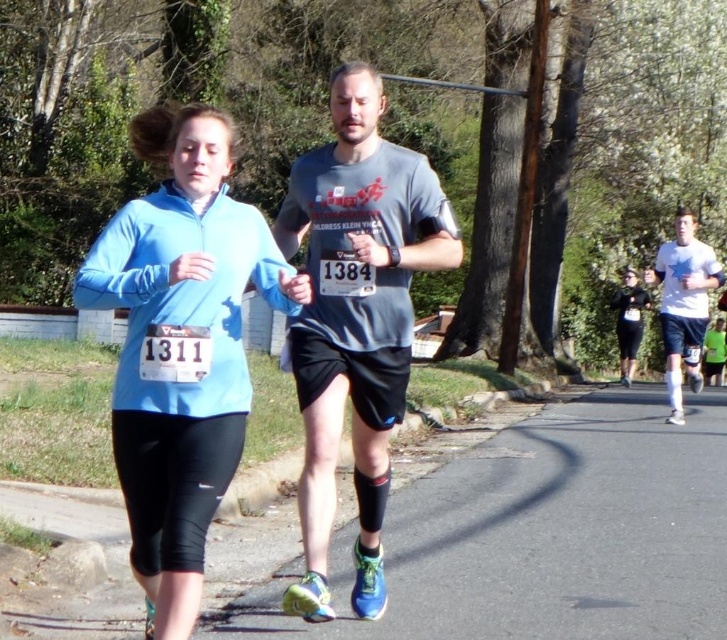
Question: Does gray matte t-shirt at center appear on the right side of black matte leggings at center?

Choices:
 (A) no
 (B) yes

Answer: (A)

Question: Is white matte t-shirt at center wider than black matte leggings at center?

Choices:
 (A) yes
 (B) no

Answer: (A)

Question: Which object is the closest to the matte blue jacket at center?

Choices:
 (A) gray matte t-shirt at center
 (B) white matte t-shirt at center
 (C) black matte leggings at center

Answer: (A)

Question: Is the position of matte blue jacket at center less distant than that of black matte leggings at center?

Choices:
 (A) no
 (B) yes

Answer: (B)

Question: Which object appears farthest from the camera in this image?

Choices:
 (A) gray matte t-shirt at center
 (B) black matte leggings at center
 (C) matte blue jacket at center

Answer: (B)

Question: Which is farther from the gray matte t-shirt at center?

Choices:
 (A) matte blue jacket at center
 (B) black matte leggings at center
 (C) white matte t-shirt at center

Answer: (B)